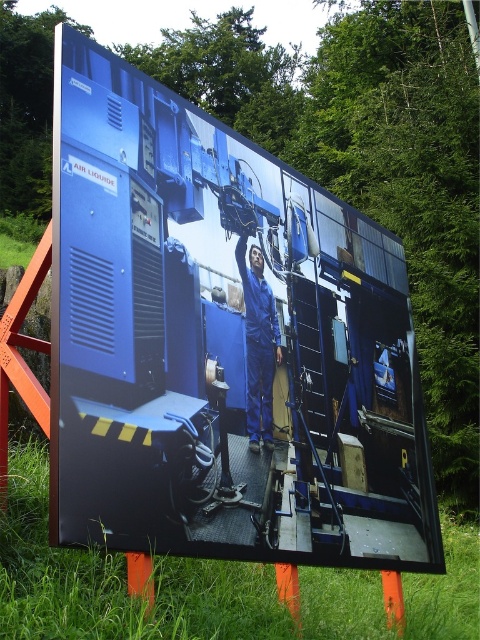
From the picture: You are a photographer standing in front of the outdoor display board. You notice the green grass at lower left and the blue smooth jumpsuit at center in the scene. Which object is taller?

The green grass at lower left is much taller than the blue smooth jumpsuit at center.

You are a maintenance technician standing in front of the blue metallic machinery at center. You need to reach a part that is 5 meters away from your current position. Can you safely extend your arm to reach it without moving closer?

The blue metallic machinery at center is 4.77 meters away from the viewer. Since the required distance to reach is 5 meters, which is slightly farther than the current distance, you cannot safely extend your arm to reach the part without moving closer.